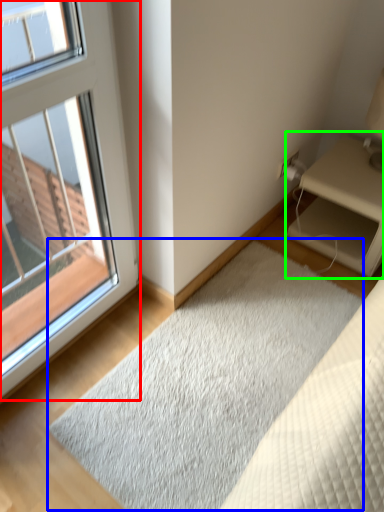
Question: Which object is the closest to the window (highlighted by a red box)? Choose among these: doormat (highlighted by a blue box) or nightstand (highlighted by a green box).

Choices:
 (A) doormat
 (B) nightstand

Answer: (A)